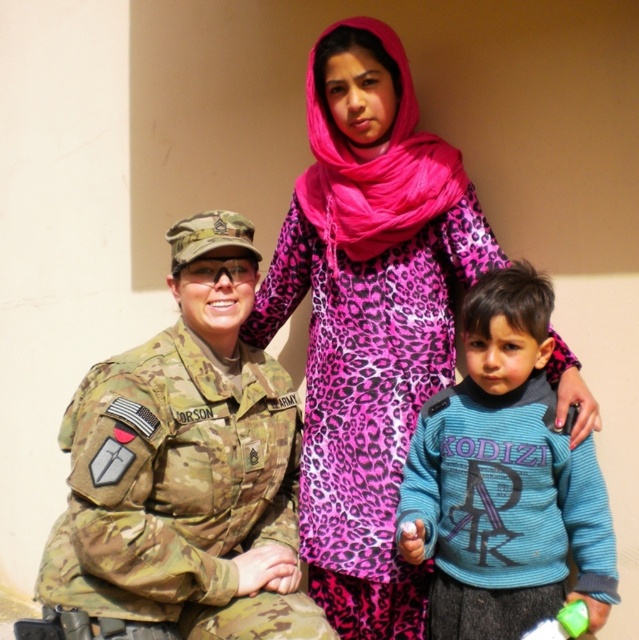
Question: Can you confirm if pink leopard print dress at center is wider than blue fleece sweater at center?

Choices:
 (A) no
 (B) yes

Answer: (B)

Question: Which point is closer to the camera?

Choices:
 (A) (204, 612)
 (B) (491, 420)

Answer: (A)

Question: Which point is closer to the camera taking this photo?

Choices:
 (A) (164, 451)
 (B) (358, 29)
 (C) (447, 540)

Answer: (A)

Question: Can you confirm if pink leopard print dress at center is positioned to the left of blue fleece sweater at center?

Choices:
 (A) no
 (B) yes

Answer: (B)

Question: Which object appears closest to the camera in this image?

Choices:
 (A) camo fabric uniform at left
 (B) pink leopard print dress at center

Answer: (A)

Question: Is pink leopard print dress at center below camo fabric uniform at left?

Choices:
 (A) no
 (B) yes

Answer: (A)